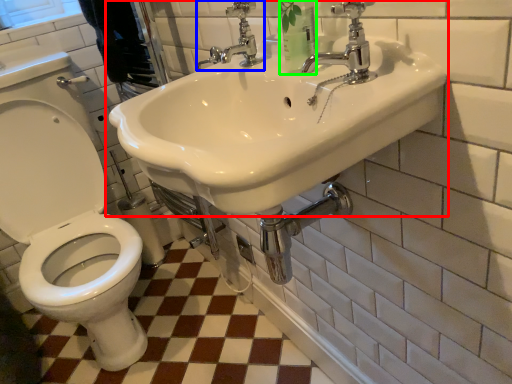
Question: Which is farther away from sink (highlighted by a red box)? tap (highlighted by a blue box) or toiletry (highlighted by a green box)?

Choices:
 (A) tap
 (B) toiletry

Answer: (A)